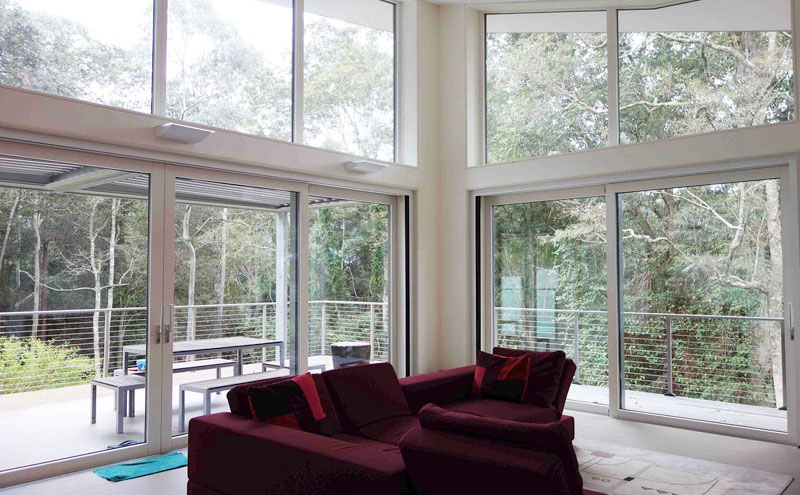
Identify the location of door. (156, 288), (168, 300), (788, 287).